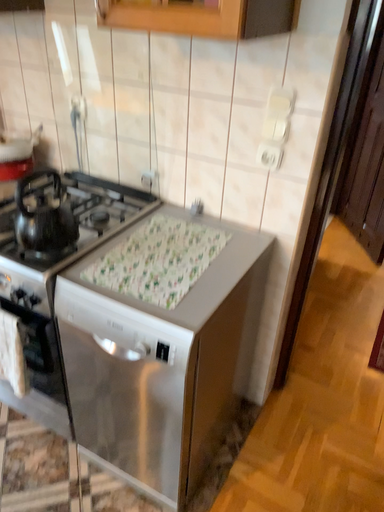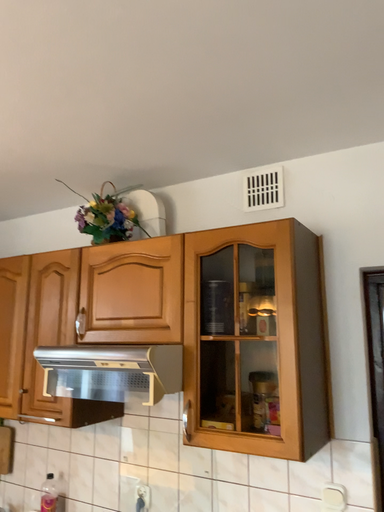
Question: How did the camera likely rotate when shooting the video?

Choices:
 (A) rotated downward
 (B) rotated upward

Answer: (B)